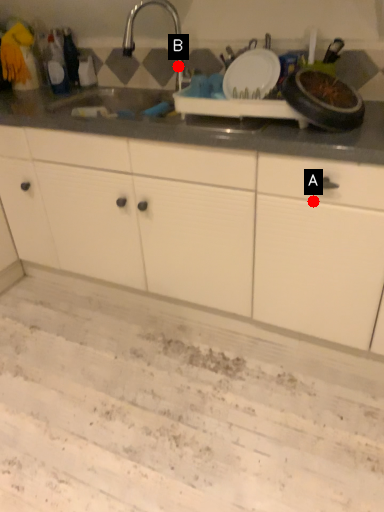
Question: Two points are circled on the image, labeled by A and B beside each circle. Which of the following is the farthest from the observer?

Choices:
 (A) A is further
 (B) B is further

Answer: (B)